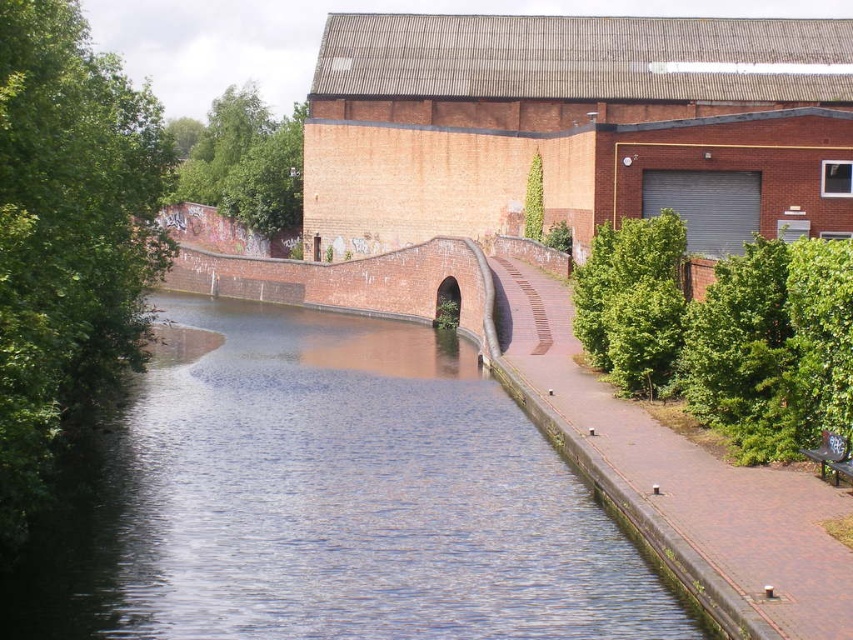
Question: Which point appears farthest from the camera in this image?

Choices:
 (A) (833, 550)
 (B) (633, 620)

Answer: (A)

Question: Which object is the closest to the brick/rough bridge at center?

Choices:
 (A) blue water at center
 (B) brick pavement at center

Answer: (A)

Question: Which is farther from the brick pavement at center?

Choices:
 (A) brick/rough bridge at center
 (B) blue water at center

Answer: (A)

Question: Does blue water at center appear over brick pavement at center?

Choices:
 (A) yes
 (B) no

Answer: (B)

Question: Is blue water at center thinner than brick pavement at center?

Choices:
 (A) yes
 (B) no

Answer: (B)

Question: Can you confirm if blue water at center is thinner than brick pavement at center?

Choices:
 (A) yes
 (B) no

Answer: (B)